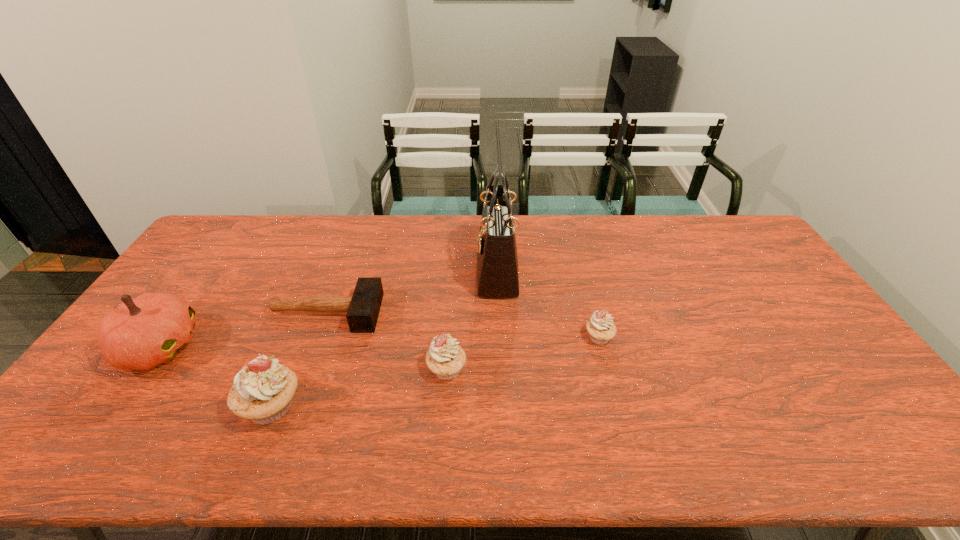
Identify the location of free space located 0.140m on the back of the second tallest cupcake. The width and height of the screenshot is (960, 540). (450, 316).

Find the location of a particular element. The width and height of the screenshot is (960, 540). free spot located on the left of the farthest cupcake is located at coordinates (503, 337).

Locate an element on the screen. free point located at the front of the second object from right to left with visible charms is located at coordinates [x=370, y=271].

The image size is (960, 540). In order to click on free region located 0.310m at the front of the second object from right to left with visible charms in this screenshot , I will do `click(384, 271)`.

This screenshot has height=540, width=960. What are the coordinates of `blank space located at the front of the second object from right to left with visible charms` in the screenshot? It's located at (391, 271).

This screenshot has height=540, width=960. What are the coordinates of `free space located on the hammer head face of the mallet` in the screenshot? It's located at (492, 313).

Identify the location of blank area located 0.280m on the front-facing side of the pumpkin. (300, 347).

Locate an element on the screen. The width and height of the screenshot is (960, 540). object that is positioned at the far edge is located at coordinates (497, 262).

This screenshot has height=540, width=960. In order to click on object that is positioned at the near edge in this screenshot , I will do `click(263, 390)`.

Identify the location of object located at the left edge. (x=143, y=332).